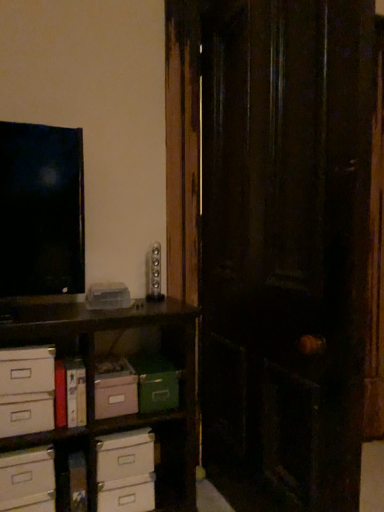
Question: Is hardcover book at lower left in front of or behind white cardboard drawer at lower left, which ranks as the 3th drawer in top-to-bottom order, in the image?

Choices:
 (A) front
 (B) behind

Answer: (B)

Question: Looking at their shapes, would you say hardcover book at lower left is wider or thinner than white cardboard drawer at lower left, the first drawer from the bottom?

Choices:
 (A) thin
 (B) wide

Answer: (B)

Question: Considering the real-world distances, which object is closest to the white cardboard boxes at lower left?

Choices:
 (A) white cardboard chest of drawers at lower left
 (B) hardcover book at lower left
 (C) dark wood door at center
 (D) white cardboard drawer at lower left, which is the 3th drawer from bottom to top
 (E) white cardboard drawer at lower left, the first drawer from the bottom

Answer: (A)

Question: Considering the real-world distances, which object is farthest from the white cardboard drawer at lower left, which ranks as the 3th drawer in top-to-bottom order?

Choices:
 (A) hardcover book at lower left
 (B) white cardboard drawer at lower left, which is counted as the second drawer, starting from the bottom
 (C) pastel pink cardboard storage box at center-left, placed as the second storage box when sorted from right to left
 (D) dark wood door at center
 (E) white cardboard chest of drawers at lower left

Answer: (D)